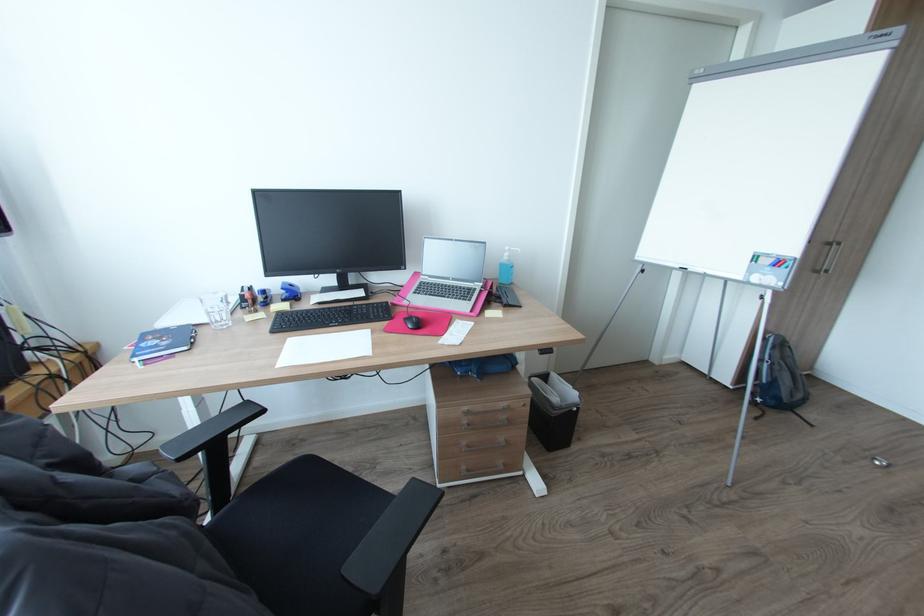
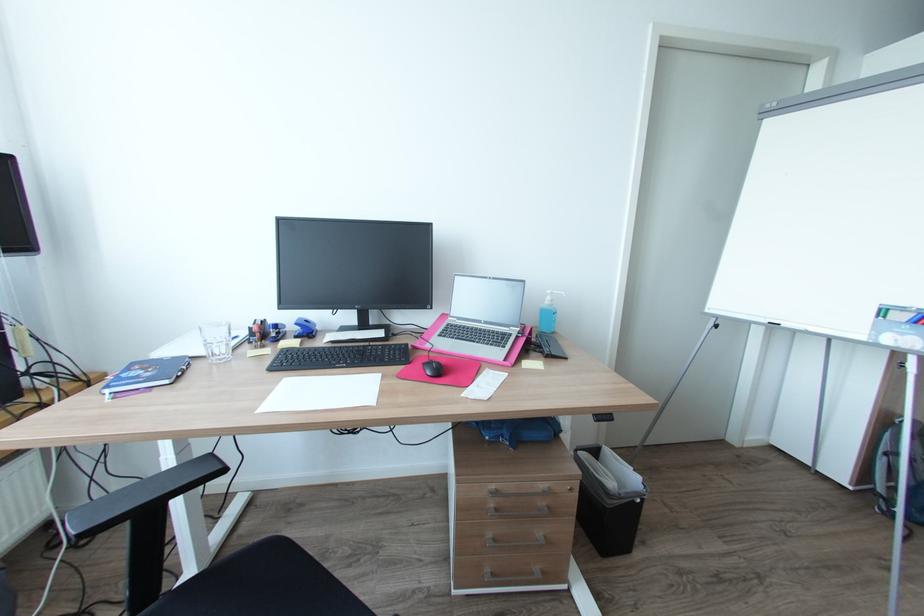
In the second image, find the point that corresponds to pixel 473 424 in the first image.

(501, 509)